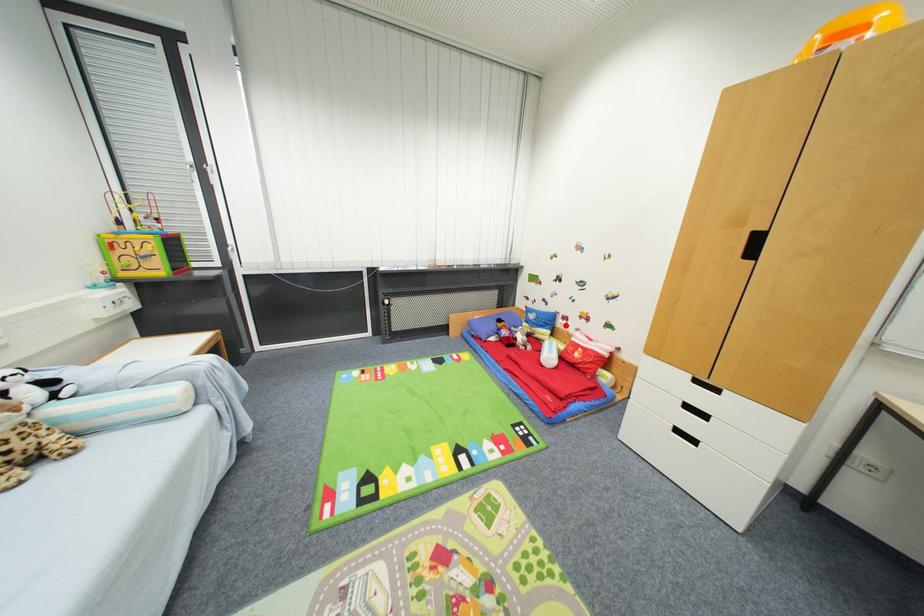
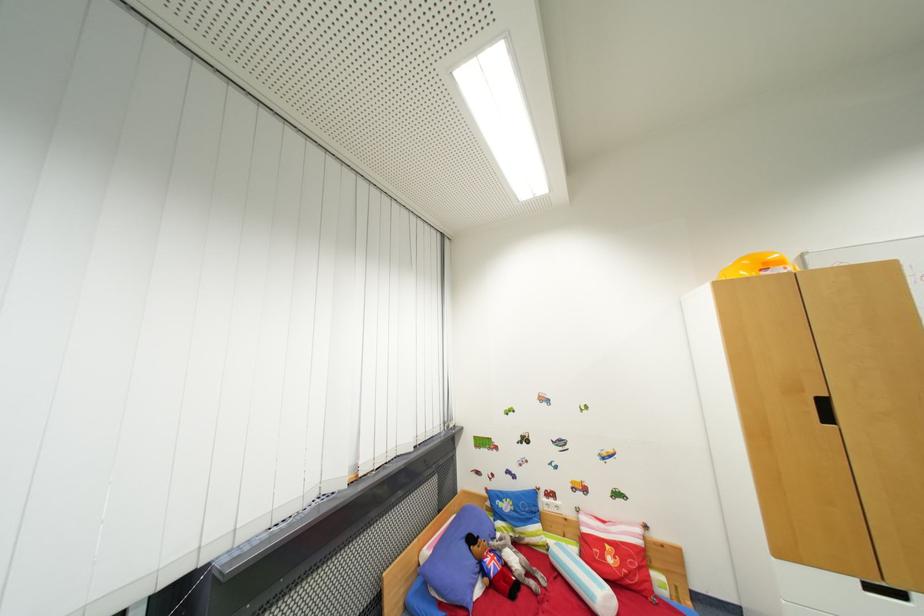
Question: I am providing you with two images of the same scene from different viewpoints. A red point is shown in image1. For the corresponding object point in image2, is it positioned nearer or farther from the camera?

Choices:
 (A) Nearer
 (B) Farther

Answer: (B)